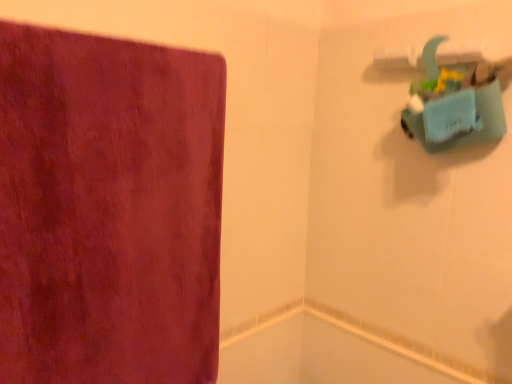
Question: From a real-world perspective, is velvet-like maroon towel at left physically located above or below white glossy bath at lower center?

Choices:
 (A) below
 (B) above

Answer: (B)

Question: Is velvet-like maroon towel at left wider or thinner than white glossy bath at lower center?

Choices:
 (A) wide
 (B) thin

Answer: (A)

Question: From their relative heights in the image, would you say velvet-like maroon towel at left is taller or shorter than white glossy bath at lower center?

Choices:
 (A) tall
 (B) short

Answer: (A)

Question: Does point (272, 377) appear closer or farther from the camera than point (24, 112)?

Choices:
 (A) farther
 (B) closer

Answer: (A)

Question: Based on their positions, is white glossy bath at lower center located to the left or right of velvet-like maroon towel at left?

Choices:
 (A) right
 (B) left

Answer: (A)

Question: Looking at the image, does white glossy bath at lower center seem bigger or smaller compared to velvet-like maroon towel at left?

Choices:
 (A) big
 (B) small

Answer: (B)

Question: From the image's perspective, relative to velvet-like maroon towel at left, is white glossy bath at lower center above or below?

Choices:
 (A) below
 (B) above

Answer: (A)